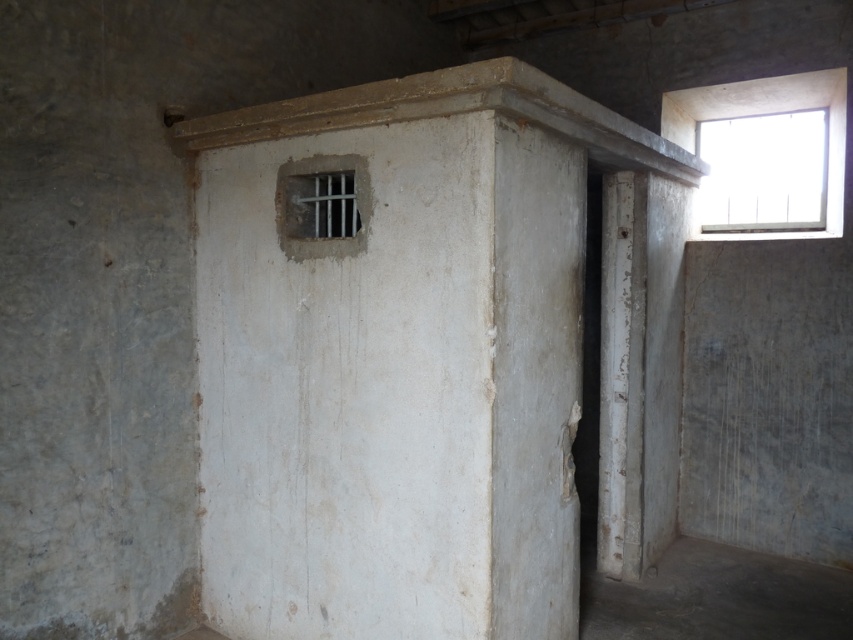
Can you confirm if clear glass window at upper right is positioned to the right of metallic bars at center?

Indeed, clear glass window at upper right is positioned on the right side of metallic bars at center.

Between clear glass window at upper right and metallic bars at center, which one appears on the right side from the viewer's perspective?

From the viewer's perspective, clear glass window at upper right appears more on the right side.

Does point (743, 161) come behind point (305, 227)?

Yes, it is behind point (305, 227).

Locate an element on the screen. clear glass window at upper right is located at coordinates (764, 172).